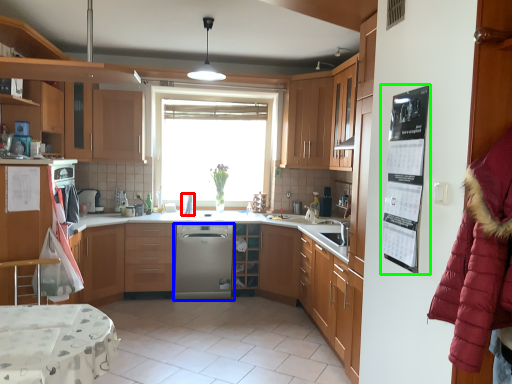
Question: Based on their relative distances, which object is nearer to appliance (highlighted by a red box)? Choose from kitchen appliance (highlighted by a blue box) and bulletin board (highlighted by a green box).

Choices:
 (A) kitchen appliance
 (B) bulletin board

Answer: (A)